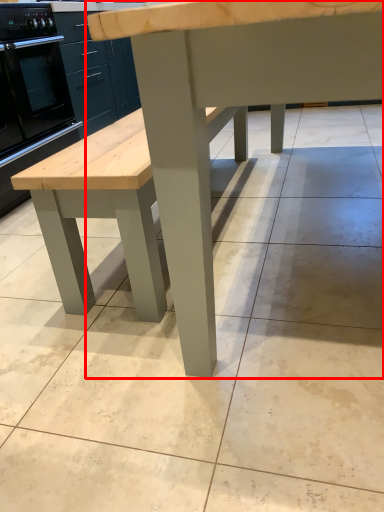
Question: Where is table (annotated by the red box) located in relation to oven in the image?

Choices:
 (A) right
 (B) left

Answer: (A)